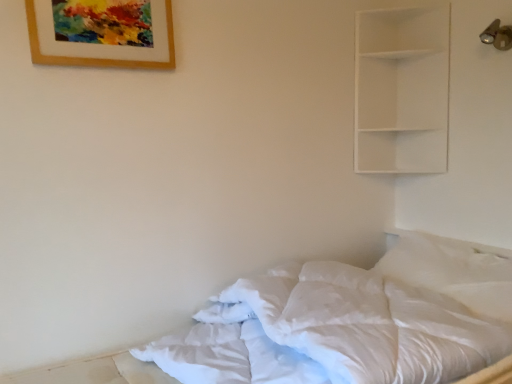
Question: From a real-world perspective, is white matte shelf at upper right above or below white soft bed at lower right?

Choices:
 (A) above
 (B) below

Answer: (A)

Question: From their relative heights in the image, would you say white matte shelf at upper right is taller or shorter than white soft bed at lower right?

Choices:
 (A) short
 (B) tall

Answer: (B)

Question: Which is farther from the wooden picture frame at upper left?

Choices:
 (A) white matte shelf at upper right
 (B) white soft bed at lower right

Answer: (A)

Question: Estimate the real-world distances between objects in this image. Which object is closer to the white soft bed at lower right?

Choices:
 (A) wooden picture frame at upper left
 (B) white matte shelf at upper right

Answer: (A)